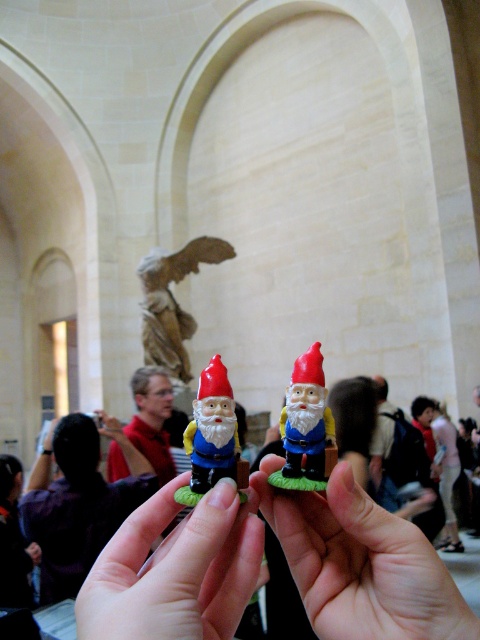
Question: Which point appears closest to the camera in this image?

Choices:
 (A) (180, 365)
 (B) (182, 500)
 (C) (315, 557)
 (D) (76, 598)

Answer: (B)

Question: Which is farther from the brown stone winged statue at center?

Choices:
 (A) matte plastic gnome at center
 (B) smooth plastic hands at center

Answer: (B)

Question: Estimate the real-world distances between objects in this image. Which object is closer to the brown stone winged statue at center?

Choices:
 (A) smooth plastic hands at center
 (B) plastic gnome at center
 (C) smooth plastic hand at center

Answer: (B)

Question: Is brown stone winged statue at center wider than plastic gnome at center?

Choices:
 (A) no
 (B) yes

Answer: (B)

Question: Is brown stone winged statue at center bigger than matte plastic gnome at center?

Choices:
 (A) no
 (B) yes

Answer: (A)

Question: Can you confirm if smooth plastic hand at center is wider than smooth plastic hands at center?

Choices:
 (A) no
 (B) yes

Answer: (B)